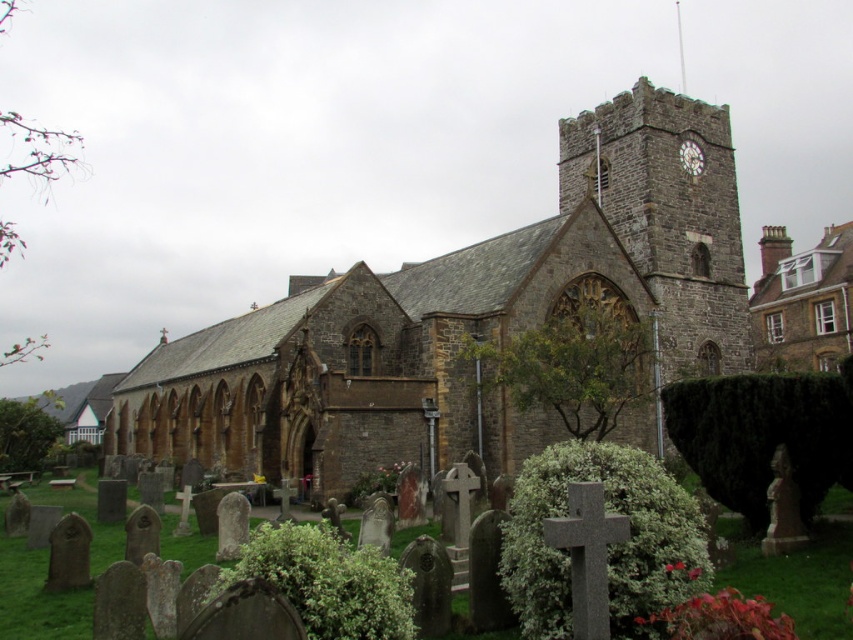
Is brown stone church at center to the right of brown stone church at upper right from the viewer's perspective?

Incorrect, brown stone church at center is not on the right side of brown stone church at upper right.

Is brown stone church at center to the left of brown stone church at upper right from the viewer's perspective?

Indeed, brown stone church at center is positioned on the left side of brown stone church at upper right.

The width and height of the screenshot is (853, 640). What do you see at coordinates (465, 321) in the screenshot?
I see `brown stone church at center` at bounding box center [465, 321].

Image resolution: width=853 pixels, height=640 pixels. I want to click on brown stone church at center, so click(465, 321).

The width and height of the screenshot is (853, 640). What are the coordinates of `brown stone church at center` in the screenshot? It's located at (465, 321).

Is brown stone church at upper right positioned in front of matte brown clock at upper right?

No.

Is brown stone church at upper right below matte brown clock at upper right?

Indeed, brown stone church at upper right is positioned under matte brown clock at upper right.

Where is `brown stone church at upper right`? This screenshot has width=853, height=640. brown stone church at upper right is located at coordinates (802, 301).